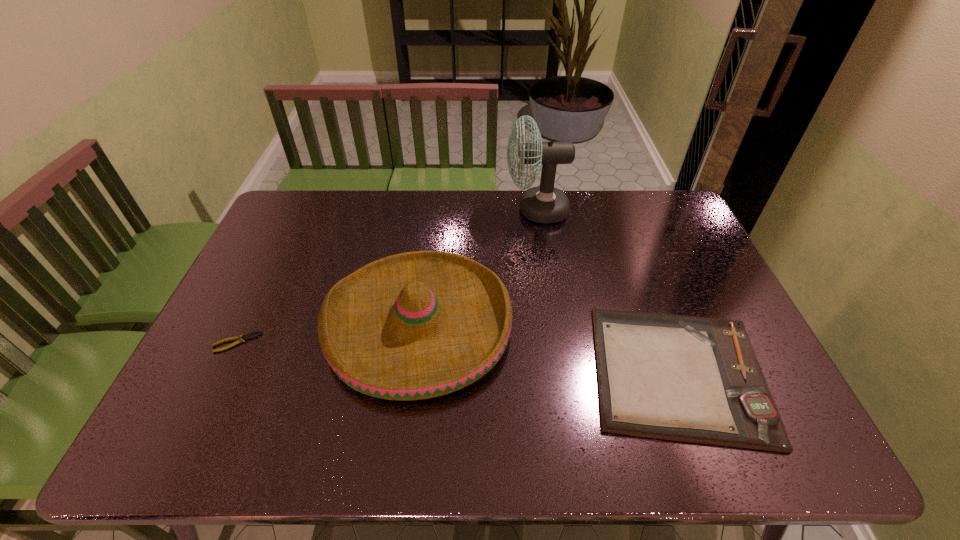
Image resolution: width=960 pixels, height=540 pixels. I want to click on free spot that satisfies the following two spatial constraints: 1. in front of the clipboard where the airflow is directed; 2. on the right side of the farthest object, so click(x=561, y=373).

I want to click on free region that satisfies the following two spatial constraints: 1. in front of the clipboard where the airflow is directed; 2. on the right side of the farthest object, so click(x=561, y=373).

The width and height of the screenshot is (960, 540). I want to click on free location that satisfies the following two spatial constraints: 1. in front of the fan where the airflow is directed; 2. on the left side of the clipboard, so click(561, 373).

The image size is (960, 540). What are the coordinates of `free spot that satisfies the following two spatial constraints: 1. on the front side of the pliers; 2. on the right side of the clipboard` in the screenshot? It's located at (222, 373).

Image resolution: width=960 pixels, height=540 pixels. In order to click on vacant space that satisfies the following two spatial constraints: 1. in front of the second shortest object where the airflow is directed; 2. on the left side of the tallest object in this screenshot , I will do `click(561, 373)`.

Locate an element on the screen. This screenshot has width=960, height=540. vacant space that satisfies the following two spatial constraints: 1. in front of the farthest object where the airflow is directed; 2. on the left side of the clipboard is located at coordinates (561, 373).

Find the location of a particular element. The width and height of the screenshot is (960, 540). free space that satisfies the following two spatial constraints: 1. on the front side of the shortest object; 2. on the left side of the clipboard is located at coordinates (222, 373).